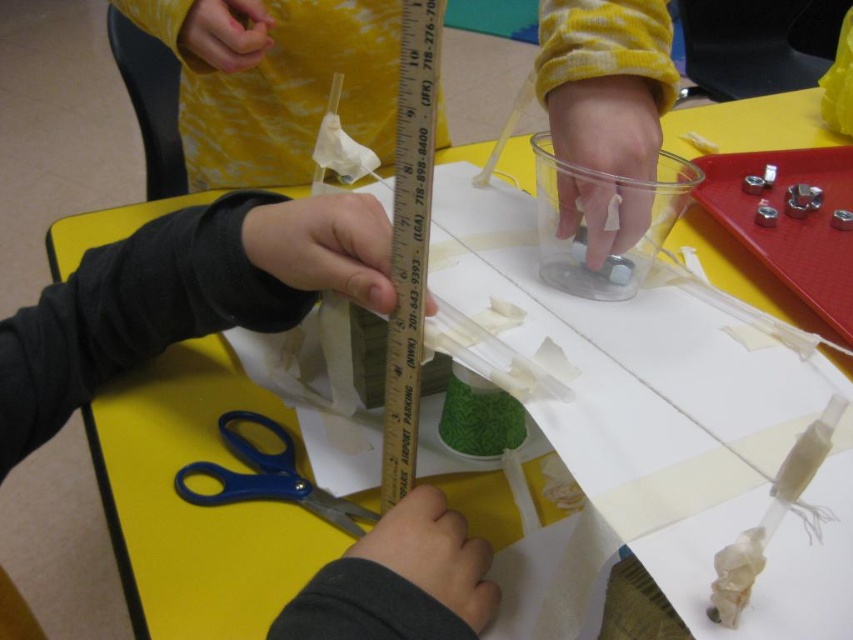
You are a child trying to reach the blue plastic scissors at lower left to cut some tape. Can you easily access them while holding the metallic ruler at center?

The metallic ruler at center is positioned over the blue plastic scissors at lower left, so you might have difficulty reaching the scissors without moving the ruler first.

You are a robot trying to reach the point at coordinates (421, 129) in the image. The robot has a maximum reach of 30 centimeters. Can you safely extend your arm to touch this point without overextending?

The distance of point (421, 129) from the camera is 29.37 centimeters, so yes, the robot can safely extend its arm to touch this point since it is within the 30 centimeter reach limit.